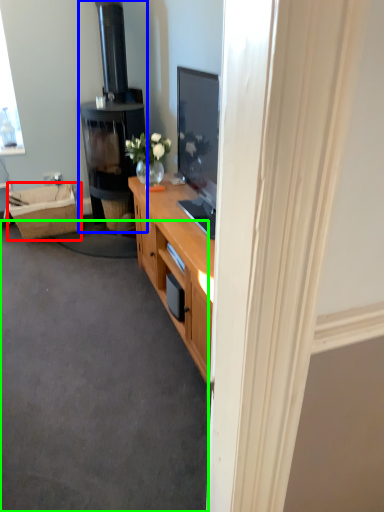
Question: Estimate the real-world distances between objects in this image. Which object is closer to picnic basket (highlighted by a red box), fireplace (highlighted by a blue box) or plain (highlighted by a green box)?

Choices:
 (A) fireplace
 (B) plain

Answer: (A)